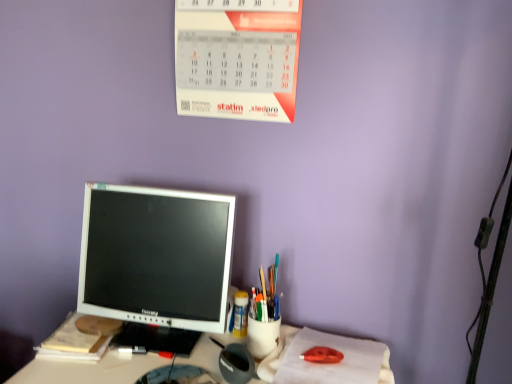
Measure the distance between point (295, 329) and camera.

They are 1.14 meters apart.

Describe the element at coordinates (156, 263) in the screenshot. I see `white glossy computer monitor at center` at that location.

At what (x,y) coordinates should I click in order to perform the action: click on translucent plastic cup at center, which ranks as the 2th stationery in front-to-back order. Please return your answer as a coordinate pair (x, y). The height and width of the screenshot is (384, 512). Looking at the image, I should click on (240, 314).

From the image's perspective, relative to red paper calendar at upper center, is yellow paper notebook at lower left above or below?

yellow paper notebook at lower left is below red paper calendar at upper center.

In the scene shown: From a real-world perspective, between yellow paper notebook at lower left and red paper calendar at upper center, who is vertically higher?

red paper calendar at upper center, from a real-world perspective.

Can you confirm if yellow paper notebook at lower left is shorter than red paper calendar at upper center?

Correct, yellow paper notebook at lower left is not as tall as red paper calendar at upper center.

Which is closer to the camera, (275, 313) or (124, 203)?

The point (124, 203) is closer to the camera.

Is matte plastic cup at center, the first stationery from the front, thinner than white glossy computer monitor at center?

Indeed, matte plastic cup at center, the first stationery from the front, has a lesser width compared to white glossy computer monitor at center.

Does matte plastic cup at center, placed as the 1th stationery when sorted from right to left, come behind white glossy computer monitor at center?

Yes, it is.

From a real-world perspective, which object rests below the other?

matte plastic cup at center, placed as the 1th stationery when sorted from right to left, is physically lower.

Is translucent plastic cup at center, arranged as the 2th stationery when viewed from the right, oriented away from yellow paper notebook at lower left?

No.

Where is `notebook in front of the translucent plastic cup at center, arranged as the 2th stationery when viewed from the right`? The image size is (512, 384). notebook in front of the translucent plastic cup at center, arranged as the 2th stationery when viewed from the right is located at coordinates (73, 343).

Can you confirm if translucent plastic cup at center, positioned as the first stationery in left-to-right order, is thinner than yellow paper notebook at lower left?

Yes.

What's the angular difference between translucent plastic cup at center, which ranks as the first stationery in back-to-front order, and yellow paper notebook at lower left's facing directions?

The angle between the facing direction of translucent plastic cup at center, which ranks as the first stationery in back-to-front order, and the facing direction of yellow paper notebook at lower left is 9.61 degrees.

From the image's perspective, is white glossy computer monitor at center located above yellow paper notebook at lower left?

Yes, from the image's perspective, white glossy computer monitor at center is on top of yellow paper notebook at lower left.

Is white glossy computer monitor at center at the right side of yellow paper notebook at lower left?

Correct, you'll find white glossy computer monitor at center to the right of yellow paper notebook at lower left.

This screenshot has height=384, width=512. I want to click on notebook to the left of white glossy computer monitor at center, so click(73, 343).

From a real-world perspective, which is physically above, white glossy computer monitor at center or yellow paper notebook at lower left?

white glossy computer monitor at center.

Is white glossy monitor at center facing towards red paper calendar at upper center?

No, white glossy monitor at center is not oriented towards red paper calendar at upper center.

Is white glossy monitor at center to the right of red paper calendar at upper center from the viewer's perspective?

No.

From the image's perspective, is white glossy monitor at center located beneath red paper calendar at upper center?

Correct, white glossy monitor at center appears lower than red paper calendar at upper center in the image.

From a real-world perspective, between yellow paper notebook at lower left and matte plastic cup at center, which ranks as the second stationery in back-to-front order, who is vertically higher?

From a 3D spatial view, matte plastic cup at center, which ranks as the second stationery in back-to-front order, is above.

Can we say yellow paper notebook at lower left lies outside matte plastic cup at center, placed as the 1th stationery when sorted from right to left?

Yes.

Considering their positions, is yellow paper notebook at lower left located in front of or behind matte plastic cup at center, which is the 2th stationery from left to right?

Visually, yellow paper notebook at lower left is located behind matte plastic cup at center, which is the 2th stationery from left to right.

Considering the sizes of objects yellow paper notebook at lower left and matte plastic cup at center, which is the 2th stationery from left to right, in the image provided, who is smaller, yellow paper notebook at lower left or matte plastic cup at center, which is the 2th stationery from left to right,?

Smaller between the two is matte plastic cup at center, which is the 2th stationery from left to right.

From a real-world perspective, between matte plastic cup at center, which is the 2th stationery from left to right, and red paper calendar at upper center, who is vertically higher?

red paper calendar at upper center.

Does matte plastic cup at center, which ranks as the second stationery in back-to-front order, appear on the right side of red paper calendar at upper center?

Yes, matte plastic cup at center, which ranks as the second stationery in back-to-front order, is to the right of red paper calendar at upper center.

From the picture: Considering the sizes of objects matte plastic cup at center, which is the 2th stationery from left to right, and red paper calendar at upper center in the image provided, who is wider, matte plastic cup at center, which is the 2th stationery from left to right, or red paper calendar at upper center?

With larger width is matte plastic cup at center, which is the 2th stationery from left to right.

Which of these two, matte plastic cup at center, which is the 2th stationery from left to right, or red paper calendar at upper center, stands shorter?

With less height is matte plastic cup at center, which is the 2th stationery from left to right.

The height and width of the screenshot is (384, 512). What are the coordinates of `notebook that is on the left side of red paper calendar at upper center` in the screenshot? It's located at (73, 343).

Image resolution: width=512 pixels, height=384 pixels. I want to click on computer monitor above the matte plastic cup at center, which ranks as the second stationery in back-to-front order (from the image's perspective), so click(156, 263).

Based on their spatial positions, is translucent plastic cup at center, which ranks as the 2th stationery in front-to-back order, or white glossy computer monitor at center closer to matte plastic cup at center, which is the 2th stationery from left to right?

translucent plastic cup at center, which ranks as the 2th stationery in front-to-back order.

Considering their positions, is translucent plastic cup at center, arranged as the 2th stationery when viewed from the right, positioned closer to yellow paper notebook at lower left than red paper calendar at upper center?

translucent plastic cup at center, arranged as the 2th stationery when viewed from the right, lies closer to yellow paper notebook at lower left than the other object.

In the scene shown: Based on their spatial positions, is white glossy monitor at center or yellow paper notebook at lower left further from white glossy computer monitor at center?

The object further to white glossy computer monitor at center is yellow paper notebook at lower left.

Based on their spatial positions, is white glossy monitor at center or red paper calendar at upper center closer to yellow paper notebook at lower left?

Based on the image, white glossy monitor at center appears to be nearer to yellow paper notebook at lower left.

Looking at the image, which one is located further to yellow paper notebook at lower left, translucent plastic cup at center, which ranks as the 2th stationery in front-to-back order, or white glossy monitor at center?

The object further to yellow paper notebook at lower left is translucent plastic cup at center, which ranks as the 2th stationery in front-to-back order.

Based on their spatial positions, is yellow paper notebook at lower left or translucent plastic cup at center, which ranks as the 2th stationery in front-to-back order, closer to white glossy computer monitor at center?

yellow paper notebook at lower left lies closer to white glossy computer monitor at center than the other object.

Which object lies further to the anchor point matte plastic cup at center, which ranks as the second stationery in back-to-front order, red paper calendar at upper center or yellow paper notebook at lower left?

Based on the image, red paper calendar at upper center appears to be further to matte plastic cup at center, which ranks as the second stationery in back-to-front order.

Considering their positions, is yellow paper notebook at lower left positioned further to white glossy monitor at center than matte plastic cup at center, the first stationery from the front?

Among the two, matte plastic cup at center, the first stationery from the front, is located further to white glossy monitor at center.

Where is `stationery between red paper calendar at upper center and translucent plastic cup at center, which ranks as the 2th stationery in front-to-back order, from top to bottom`? Image resolution: width=512 pixels, height=384 pixels. stationery between red paper calendar at upper center and translucent plastic cup at center, which ranks as the 2th stationery in front-to-back order, from top to bottom is located at coordinates (267, 295).

Where is `computer monitor between red paper calendar at upper center and matte plastic cup at center, the first stationery from the front, from top to bottom`? computer monitor between red paper calendar at upper center and matte plastic cup at center, the first stationery from the front, from top to bottom is located at coordinates (156, 263).

Where is `notebook between red paper calendar at upper center and white glossy monitor at center from top to bottom`? The height and width of the screenshot is (384, 512). notebook between red paper calendar at upper center and white glossy monitor at center from top to bottom is located at coordinates (73, 343).

Locate an element on the screen. desk located between yellow paper notebook at lower left and matte plastic cup at center, placed as the 1th stationery when sorted from right to left, in the left-right direction is located at coordinates (88, 370).